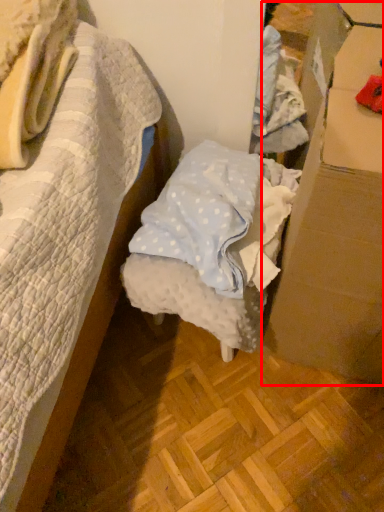
Question: From the image's perspective, what is the correct spatial relationship of cardboard box (annotated by the red box) in relation to furniture?

Choices:
 (A) above
 (B) below

Answer: (B)